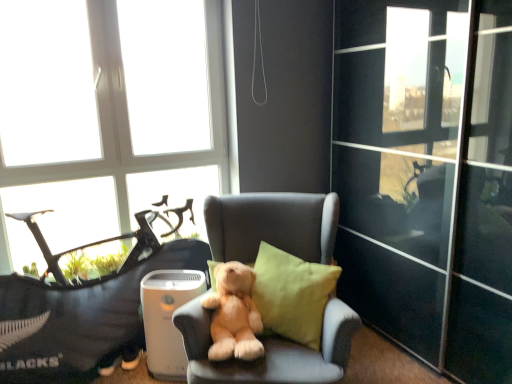
Question: Is soft gray armchair at center bigger than soft fabric teddy bear at center?

Choices:
 (A) no
 (B) yes

Answer: (B)

Question: Does soft gray armchair at center appear on the right side of soft fabric teddy bear at center?

Choices:
 (A) yes
 (B) no

Answer: (A)

Question: From a real-world perspective, is soft gray armchair at center physically below soft fabric teddy bear at center?

Choices:
 (A) no
 (B) yes

Answer: (A)

Question: From the image's perspective, would you say soft gray armchair at center is shown under soft fabric teddy bear at center?

Choices:
 (A) yes
 (B) no

Answer: (A)

Question: Is soft fabric teddy bear at center surrounded by soft gray armchair at center?

Choices:
 (A) no
 (B) yes

Answer: (A)

Question: From a real-world perspective, is soft gray armchair at center positioned over soft fabric teddy bear at center based on gravity?

Choices:
 (A) no
 (B) yes

Answer: (B)

Question: Does linen cushion at center contain soft plush bear at center?

Choices:
 (A) yes
 (B) no

Answer: (B)

Question: Does linen cushion at center have a larger size compared to soft plush bear at center?

Choices:
 (A) no
 (B) yes

Answer: (B)

Question: Is linen cushion at center closer to the viewer compared to soft plush bear at center?

Choices:
 (A) yes
 (B) no

Answer: (B)

Question: Is linen cushion at center taller than soft plush bear at center?

Choices:
 (A) no
 (B) yes

Answer: (B)

Question: From the image's perspective, would you say linen cushion at center is shown under soft plush bear at center?

Choices:
 (A) no
 (B) yes

Answer: (A)

Question: Does linen cushion at center touch soft plush bear at center?

Choices:
 (A) yes
 (B) no

Answer: (B)

Question: From a real-world perspective, is transparent glass window at upper left over soft plush bear at center?

Choices:
 (A) yes
 (B) no

Answer: (A)